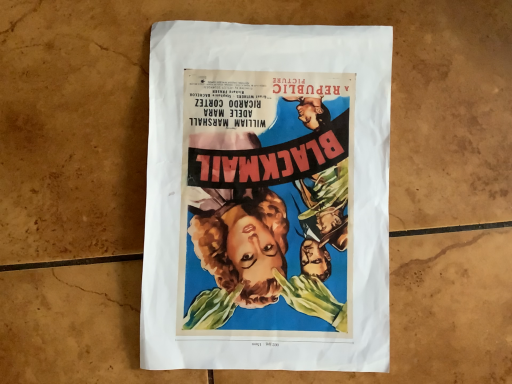
Where is `free space above vibrant paper poster at center (from a real-world perspective)`? This screenshot has height=384, width=512. free space above vibrant paper poster at center (from a real-world perspective) is located at coordinates (267, 185).